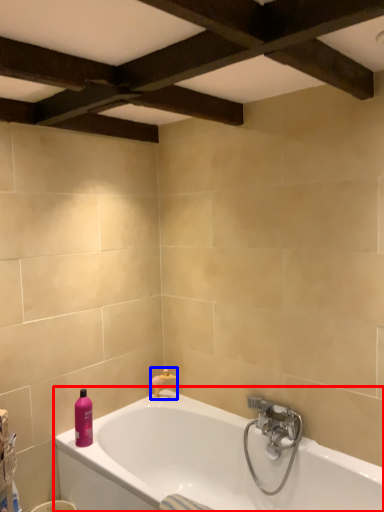
Question: Which object is closer to the camera taking this photo, bathtub (highlighted by a red box) or faucet (highlighted by a blue box)?

Choices:
 (A) bathtub
 (B) faucet

Answer: (A)